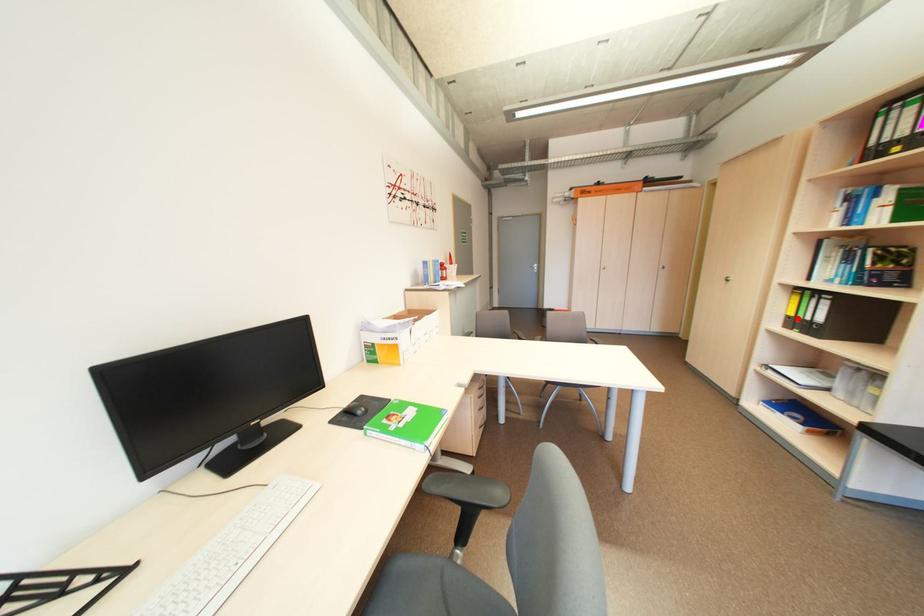
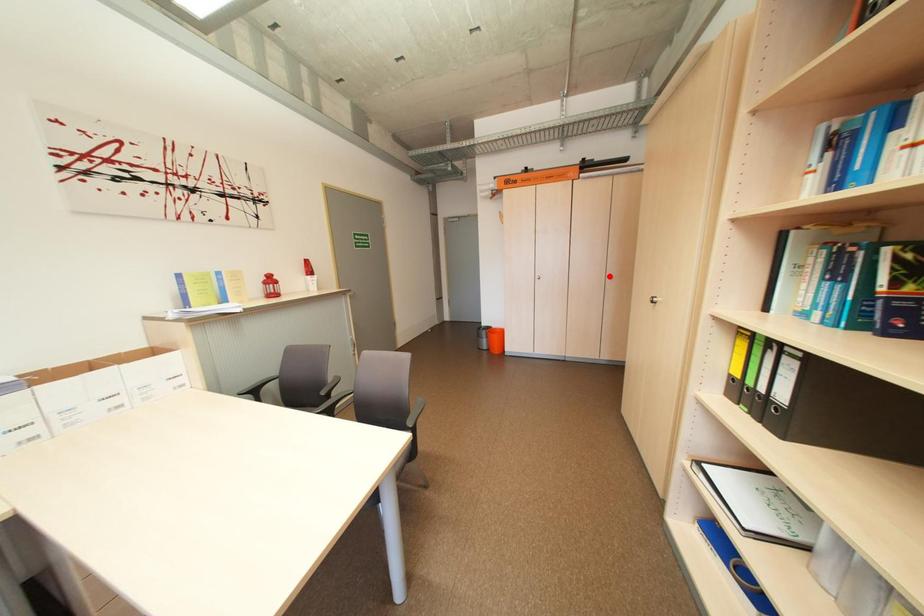
I am providing you with two images of the same scene from different viewpoints. A red point is marked on the first image and another point is marked on the second image. Does the point marked in image1 correspond to the same location as the one in image2?

No